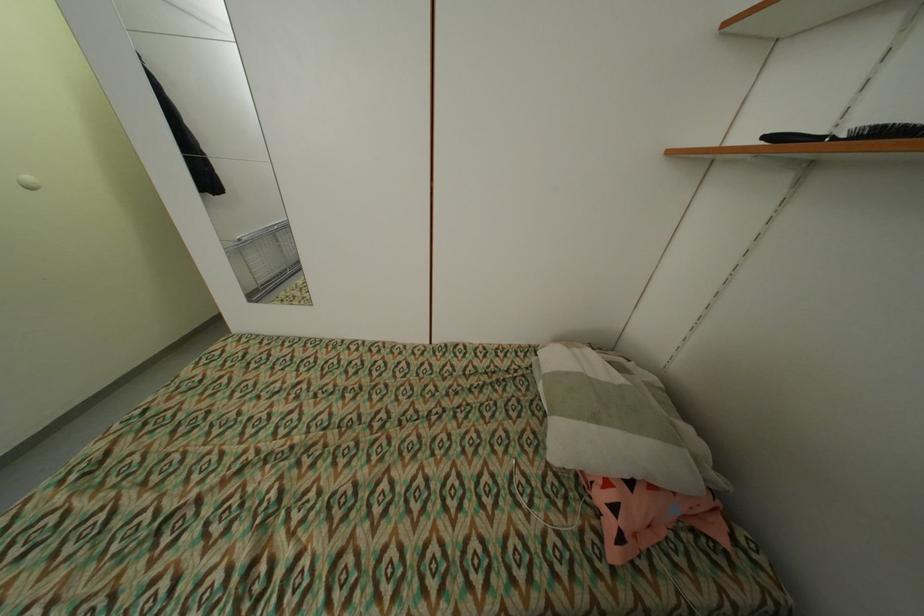
Where would you grasp the black hairbrush? Please return your answer as a coordinate pair (x, y).

(849, 134)